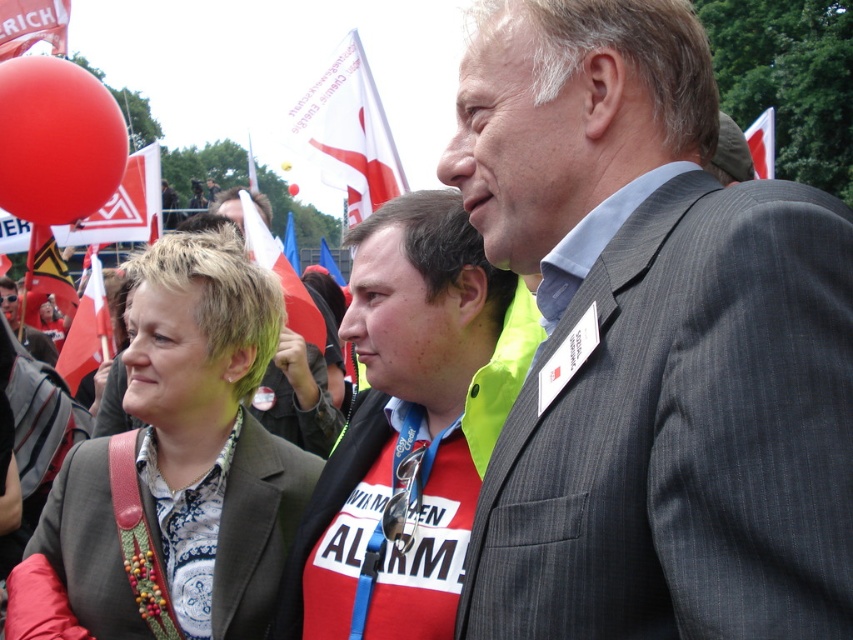
You are a photographer setting up for a group photo at the event. You need to ensure that the matte gray blazer at center and the red shirt at center are both visible in the frame. Based on their positions, which clothing item will appear taller in the photo?

The matte gray blazer at center will appear taller in the photo because it has a greater height compared to the red shirt at center according to the description.

You are a photographer trying to capture a clear shot of the matte gray blazer at center and the red shirt at center. Which one would appear closer to you in the photo?

The matte gray blazer at center would appear closer to you in the photo because it is positioned further to the viewer compared to the red shirt at center.

You are a photographer at the event and want to capture the matte gray blazer at center and the red shirt at center in a single photo. Which clothing item will appear higher in the photo?

The matte gray blazer at center is positioned above the red shirt at center, so it will appear higher in the photo.